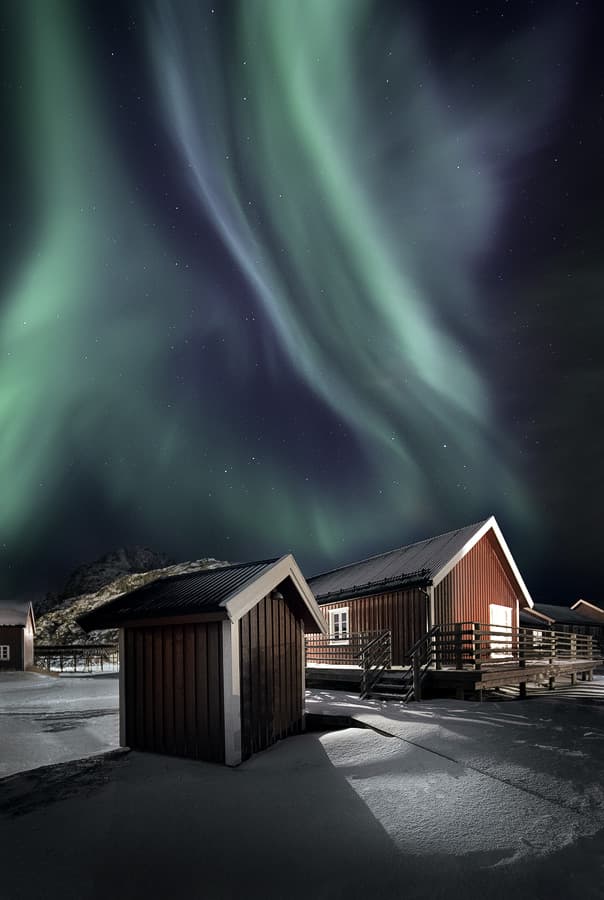
Where is `white trim`? This screenshot has width=604, height=900. white trim is located at coordinates (246, 599), (440, 574), (336, 610), (2, 654), (583, 600).